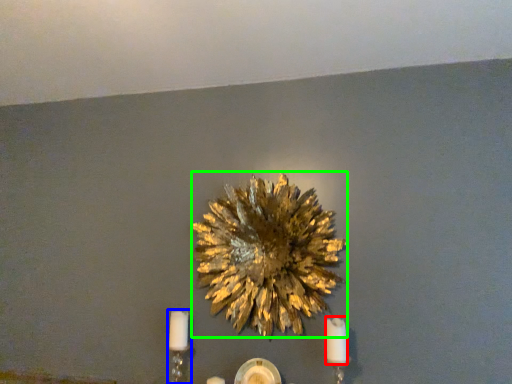
Question: Which is farther away from candle (highlighted by a red box)? candle holder (highlighted by a blue box) or flower (highlighted by a green box)?

Choices:
 (A) candle holder
 (B) flower

Answer: (A)